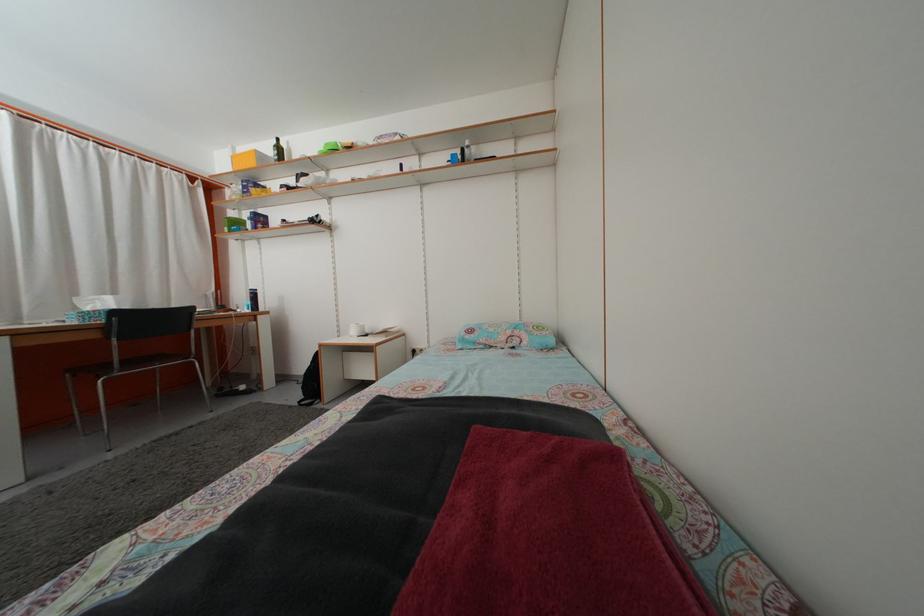
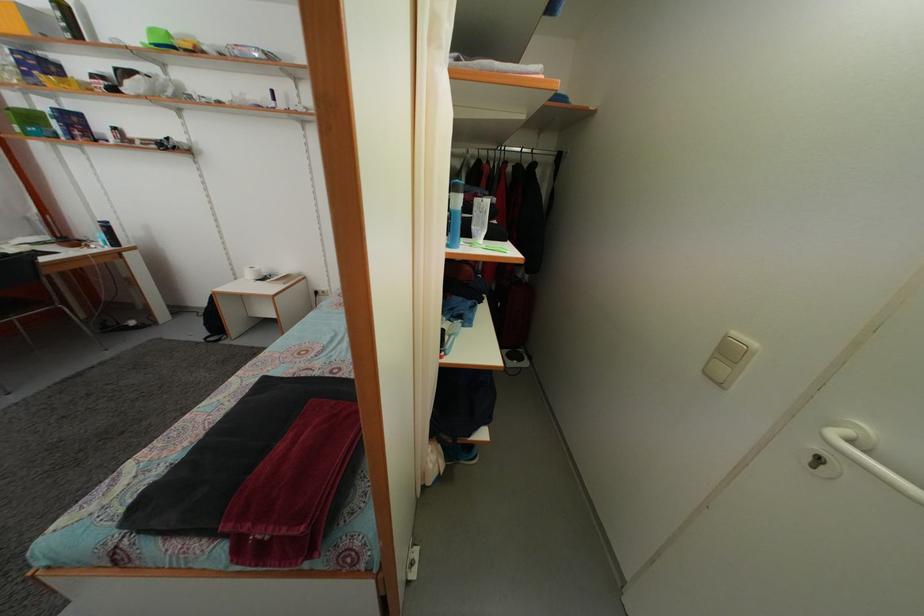
The images are taken continuously from a first-person perspective. In which direction is your viewpoint rotating?

The camera rotated toward right-down.